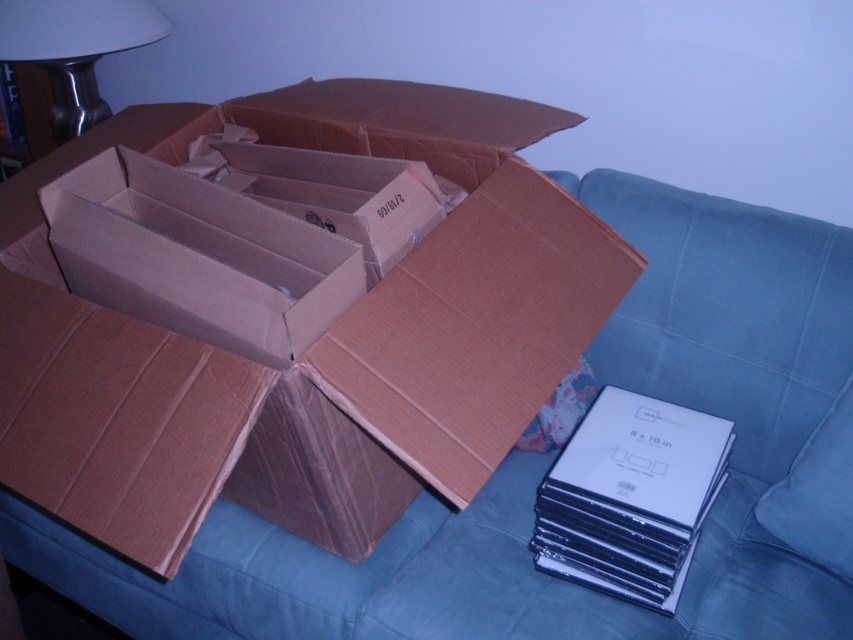
Based on the photo, can you confirm if brown corrugated cardboard box at center is taller than white matte lampshade at upper left?

Indeed, brown corrugated cardboard box at center has a greater height compared to white matte lampshade at upper left.

Is point (415, 435) behind point (49, 76)?

No, (415, 435) is closer to viewer.

Locate an element on the screen. brown corrugated cardboard box at center is located at coordinates (285, 316).

Where is `brown corrugated cardboard box at center`? The image size is (853, 640). brown corrugated cardboard box at center is located at coordinates (285, 316).